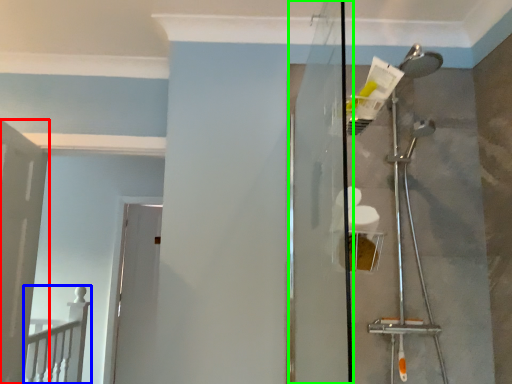
Question: Based on their relative distances, which object is nearer to door (highlighted by a red box)? Choose from rail (highlighted by a blue box) and screen door (highlighted by a green box).

Choices:
 (A) rail
 (B) screen door

Answer: (A)